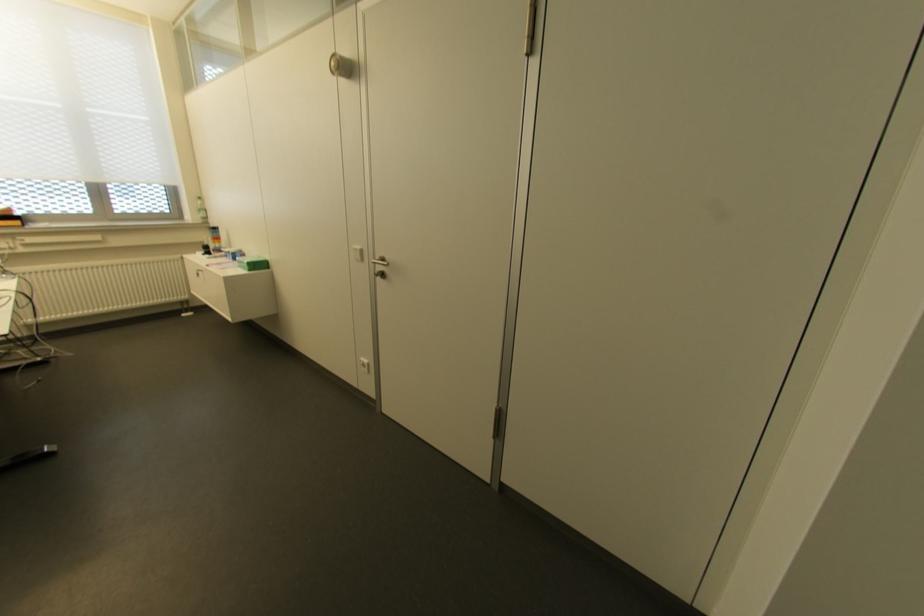
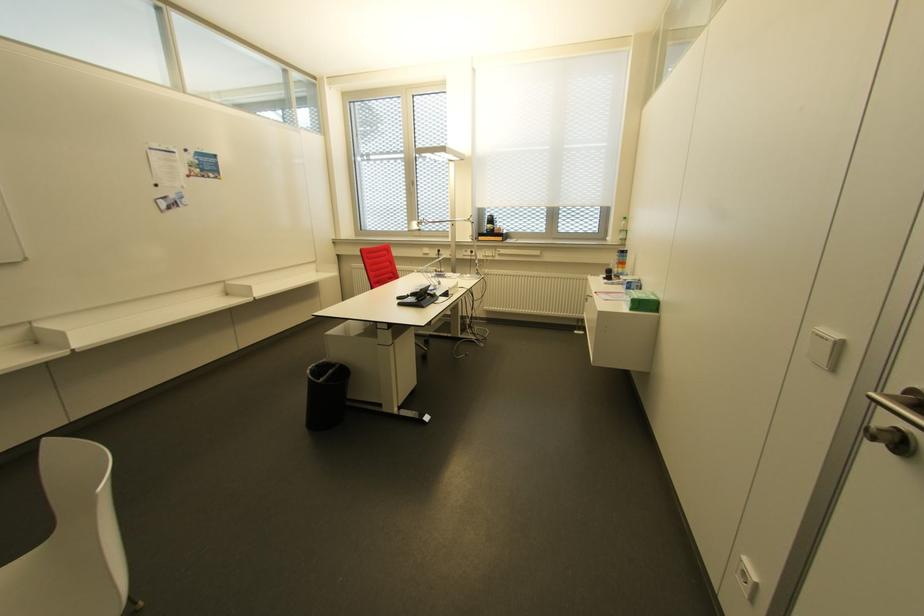
Locate, in the second image, the point that corresponds to point (358, 246) in the first image.

(833, 334)